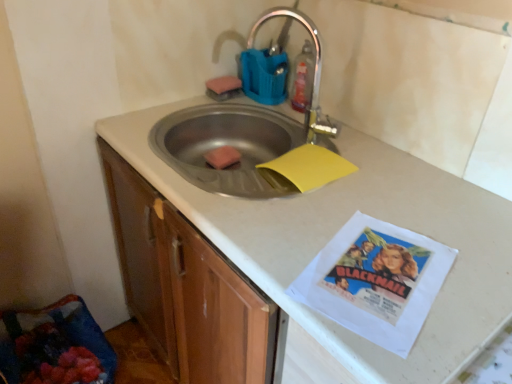
Where is `vacant region in front of translucent plastic bottle at upper center`? This screenshot has height=384, width=512. vacant region in front of translucent plastic bottle at upper center is located at coordinates click(325, 136).